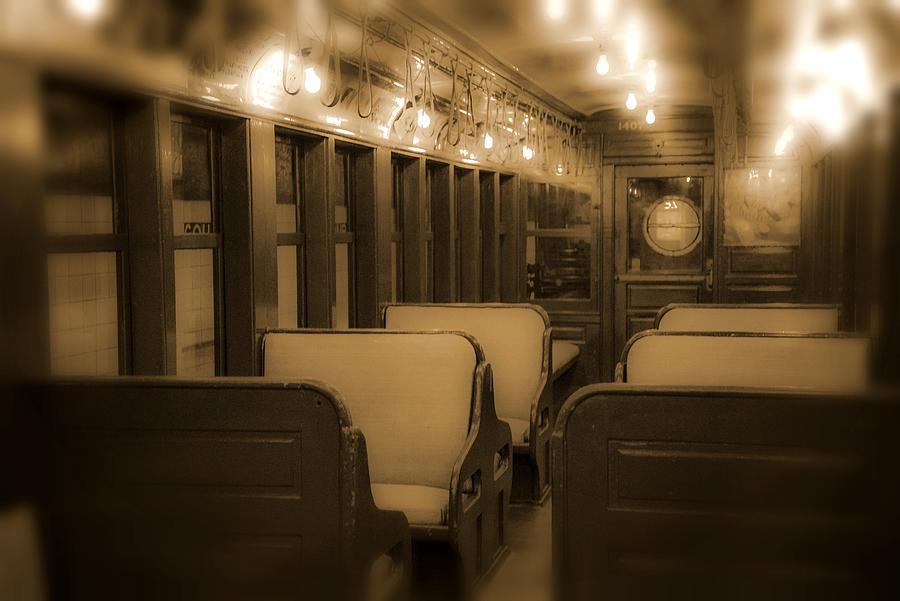
Locate an element on the screen. Image resolution: width=900 pixels, height=601 pixels. brick wall is located at coordinates (186, 315).